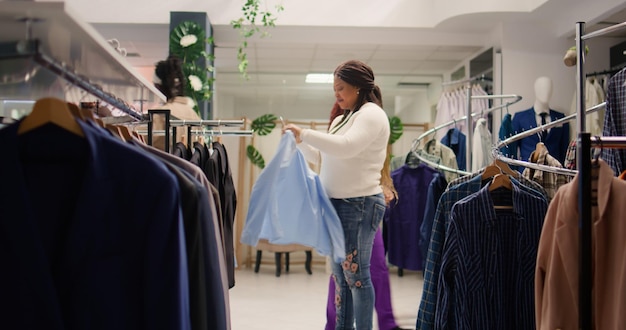
Image resolution: width=626 pixels, height=330 pixels. In order to click on seat legs in this screenshot , I will do `click(279, 268)`, `click(258, 260)`, `click(285, 259)`, `click(308, 258)`.